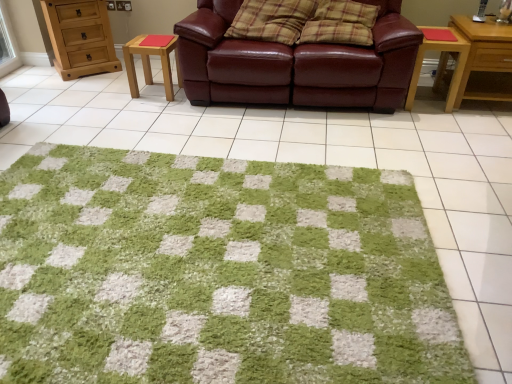
Locate an element on the screen. Image resolution: width=512 pixels, height=384 pixels. space that is in front of wooden side table at right, the second table viewed from the left is located at coordinates (436, 119).